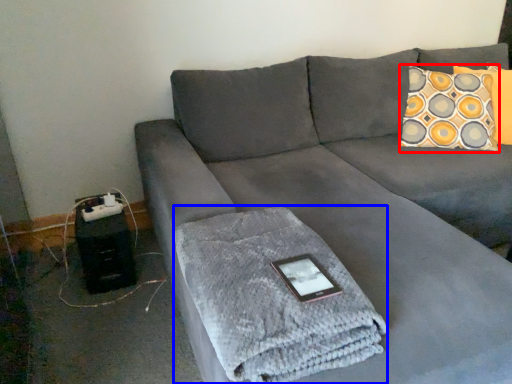
Question: Which object is closer to the camera taking this photo, throw pillow (highlighted by a red box) or bath towel (highlighted by a blue box)?

Choices:
 (A) throw pillow
 (B) bath towel

Answer: (B)